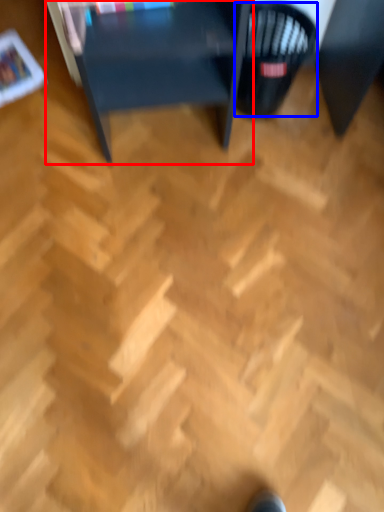
Question: Which object appears farthest to the camera in this image, table (highlighted by a red box) or basket (highlighted by a blue box)?

Choices:
 (A) table
 (B) basket

Answer: (B)